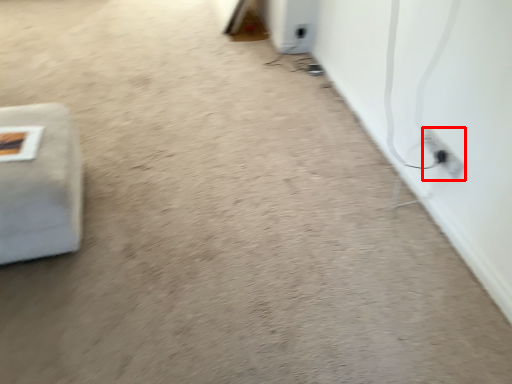
Question: In this image, where is electric outlet (annotated by the red box) located relative to furniture?

Choices:
 (A) right
 (B) left

Answer: (A)